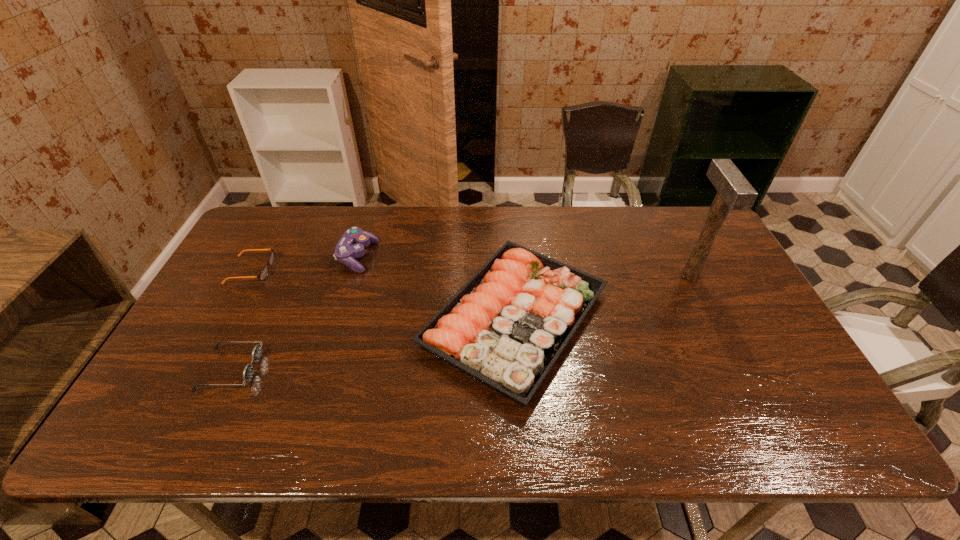
You are a GUI agent. You are given a task and a screenshot of the screen. Output one action in this format:
    pyautogui.click(x=<x>, y=<y>)
    Task: Click on the unoccupied position between the spectacles and the third object from right to left
    The width and height of the screenshot is (960, 540).
    Given the screenshot: What is the action you would take?
    pyautogui.click(x=304, y=264)

What are the coordinates of `the fourth closest object to the fourth tallest object` in the screenshot? It's located at (734, 192).

Where is `object that stands as the fourth closest to the tallest object`? The image size is (960, 540). object that stands as the fourth closest to the tallest object is located at coordinates (265, 271).

Find the location of a particular element. The height and width of the screenshot is (540, 960). vacant area that satisfies the following two spatial constraints: 1. on the front-facing side of the shortest object; 2. on the right side of the third shortest object is located at coordinates (225, 319).

The image size is (960, 540). In order to click on free spot that satisfies the following two spatial constraints: 1. on the front side of the third object from left to right; 2. on the left side of the platter in this screenshot , I will do `click(339, 319)`.

Where is `vacant area in the image that satisfies the following two spatial constraints: 1. on the front-facing side of the shortest object; 2. on the back side of the mallet`? vacant area in the image that satisfies the following two spatial constraints: 1. on the front-facing side of the shortest object; 2. on the back side of the mallet is located at coordinates (249, 275).

In order to click on free point that satisfies the following two spatial constraints: 1. on the front-facing side of the mallet; 2. on the left side of the spectacles in this screenshot , I will do [249, 275].